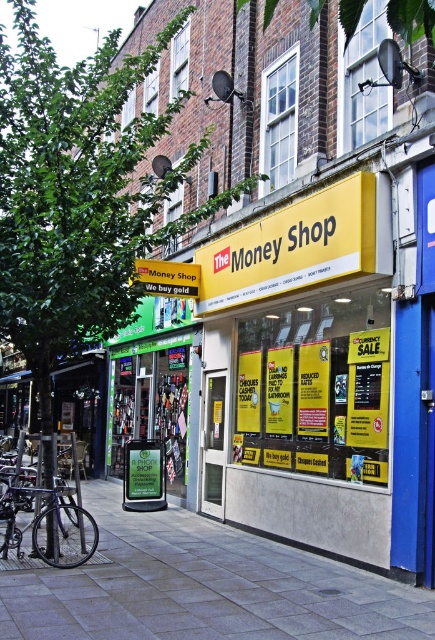
Question: Which point is closer to the camera taking this photo?

Choices:
 (A) (331, 252)
 (B) (110, 296)
 (C) (40, 500)

Answer: (C)

Question: Among these points, which one is nearest to the camera?

Choices:
 (A) (321, 252)
 (B) (33, 218)
 (C) (91, 548)
 (D) (314, 604)

Answer: (D)

Question: Is the position of gray concrete pavement at lower center more distant than that of yellow matte sign at center?

Choices:
 (A) no
 (B) yes

Answer: (A)

Question: Is green leafy tree at upper left below black matte bicycle at lower left?

Choices:
 (A) yes
 (B) no

Answer: (B)

Question: Where is green leafy tree at upper left located in relation to yellow matte sign at center in the image?

Choices:
 (A) below
 (B) above

Answer: (B)

Question: Which point is closer to the camera?

Choices:
 (A) (231, 556)
 (B) (7, 67)
 (C) (6, 545)
 (D) (314, 193)

Answer: (C)